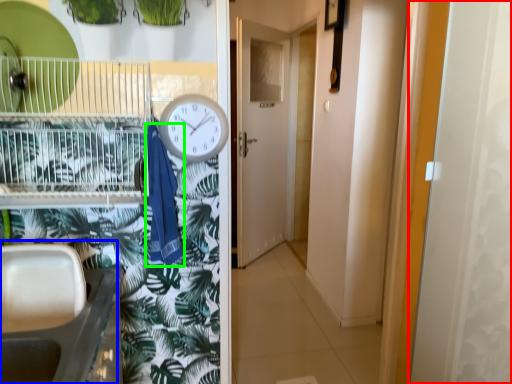
Question: Considering the real-world distances, which object is farthest from screen door (highlighted by a red box)? sink (highlighted by a blue box) or laundry (highlighted by a green box)?

Choices:
 (A) sink
 (B) laundry

Answer: (A)